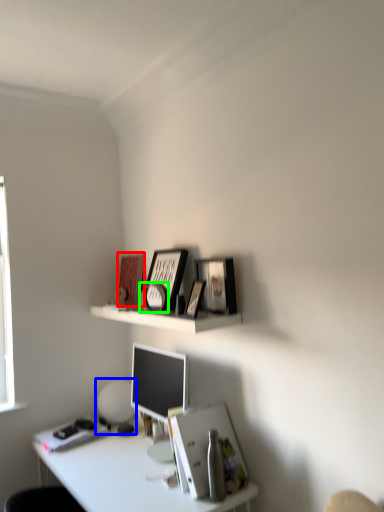
Question: Which is nearer to the book cover (highlighted by a red box)? table lamp (highlighted by a blue box) or picture frame (highlighted by a green box).

Choices:
 (A) table lamp
 (B) picture frame

Answer: (B)